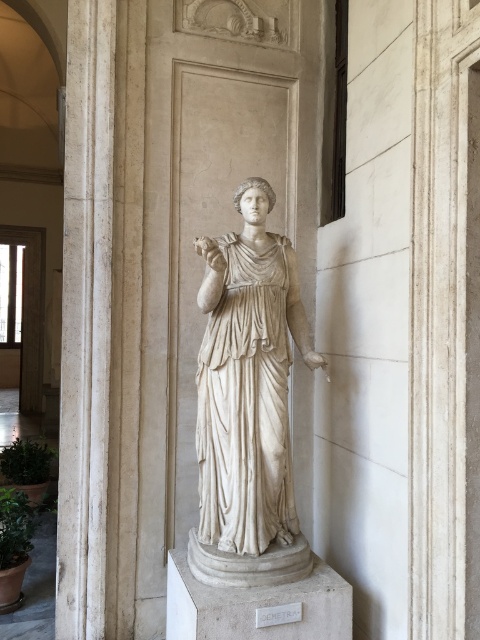
You are standing in the museum and want to take a photo of the white marble statue at center and the white marble pillar at center. Which object should you focus on first to ensure both are in the frame?

You should focus on the white marble statue at center first because it is closer to you than the white marble pillar at center, so adjusting the focus from the closer statue to the pillar will help keep both in the frame.

You are an art conservator assessing the space between the white marble statue at center and the white marble pillar at center. You need to install a protective barrier that must be at least 1.2 meters wide. Is there enough space between them?

The white marble statue at center is bigger than the white marble pillar at center, but the description does not provide the exact distance between them. Therefore, it is impossible to determine if the space is sufficient for the barrier.